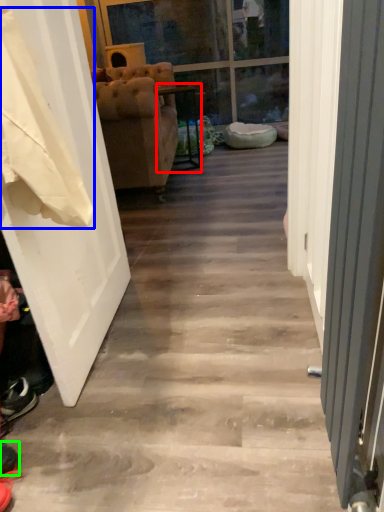
Question: Based on their relative distances, which object is nearer to furniture (highlighted by a red box)? Choose from laundry (highlighted by a blue box) and footwear (highlighted by a green box).

Choices:
 (A) laundry
 (B) footwear

Answer: (A)